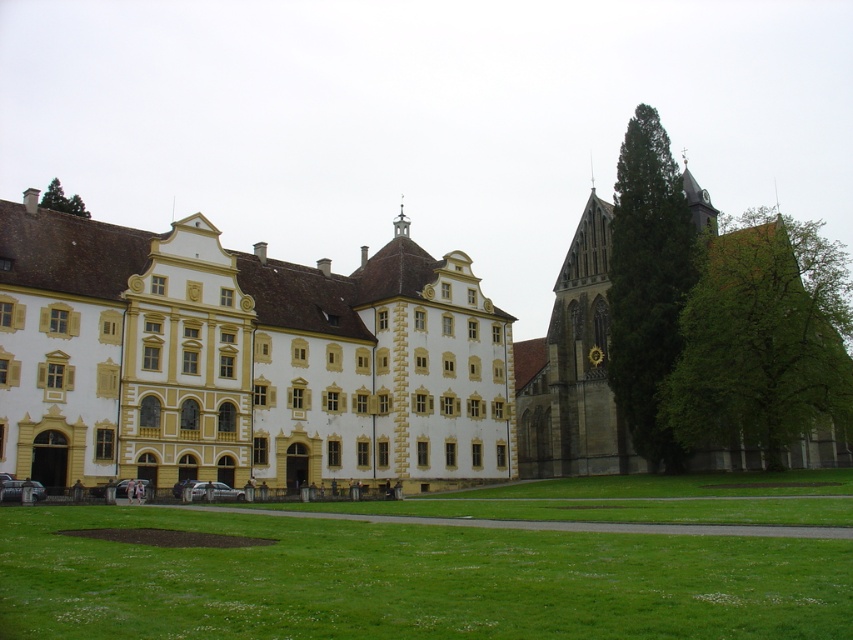
Is yellow stone church at center above green grass at lower center?

Yes, yellow stone church at center is above green grass at lower center.

Does point (91, 328) lie behind point (618, 604)?

That is True.

Which is behind, point (231, 456) or point (316, 556)?

Positioned behind is point (231, 456).

Locate an element on the screen. The image size is (853, 640). yellow stone church at center is located at coordinates (242, 358).

How distant is green grass at lower center from green leafy tree at right?

They are 31.42 meters apart.

Looking at this image, can you confirm if green grass at lower center is thinner than green leafy tree at right?

Correct, green grass at lower center's width is less than green leafy tree at right's.

Identify the location of green grass at lower center. Image resolution: width=853 pixels, height=640 pixels. (408, 580).

The image size is (853, 640). In order to click on green grass at lower center in this screenshot , I will do `click(408, 580)`.

Which is more to the right, yellow stone church at center or green textured tree at right?

Positioned to the right is green textured tree at right.

Is yellow stone church at center shorter than green textured tree at right?

Indeed, yellow stone church at center has a lesser height compared to green textured tree at right.

Between point (328, 468) and point (643, 419), which one is positioned behind?

The point (643, 419) is more distant.

Identify the location of yellow stone church at center. (242, 358).